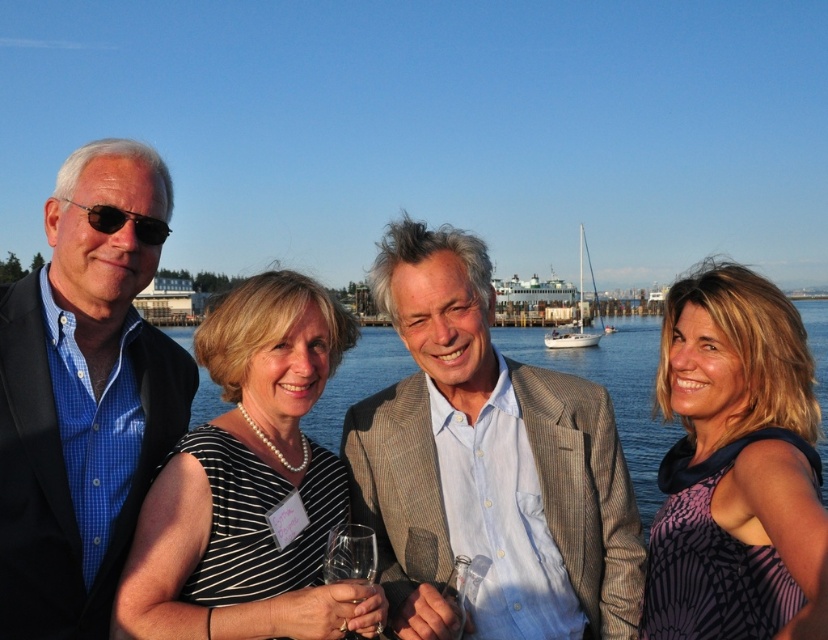
Looking at this image, you are a photographer trying to capture the clear blue water at center and the clear glass wine glass at center in a single shot. Based on their positions, which object is more likely to be fully visible in the frame without any part being cut off?

The clear blue water at center is wider than the clear glass wine glass at center, so the wine glass is narrower and more likely to be fully visible in the frame.

You are a photographer trying to capture the group photo. You notice the black striped dress at center and the clear blue water at center. Which object is positioned lower in the image?

The black striped dress at center is located below clear blue water at center, so the black striped dress at center is positioned lower in the image.